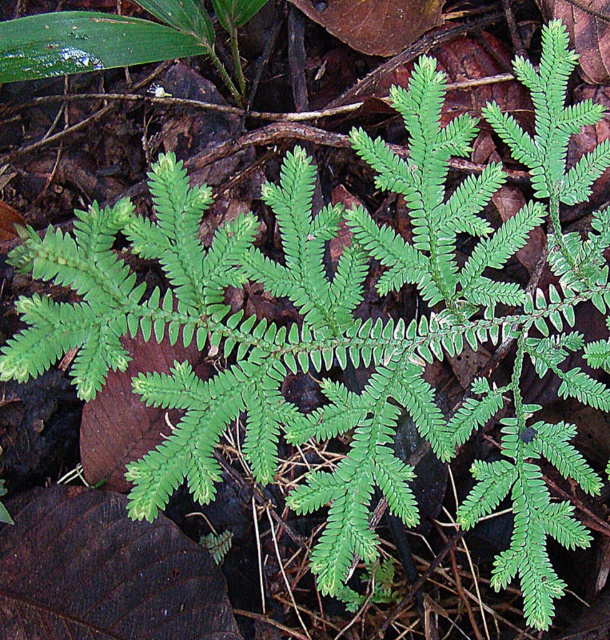
Locate an element on the screen. dark brown textured leaf at lower left is located at coordinates (104, 573).

What do you see at coordinates (104, 573) in the screenshot? The image size is (610, 640). I see `dark brown textured leaf at lower left` at bounding box center [104, 573].

Identify the location of dark brown textured leaf at lower left. This screenshot has height=640, width=610. (104, 573).